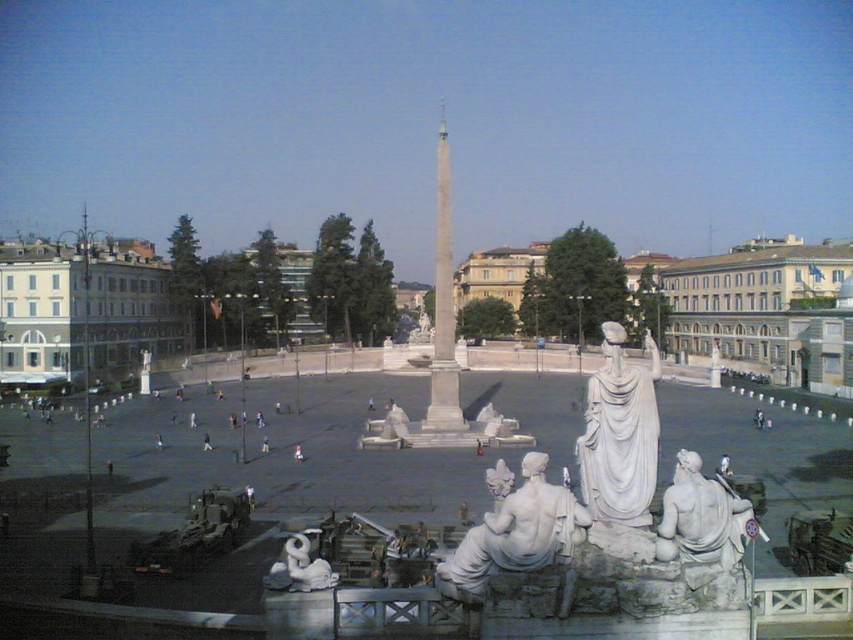
Question: Which is nearer to the white marble obelisk at center?

Choices:
 (A) white marble statue at lower center
 (B) white marble statue at lower right

Answer: (A)

Question: Can you confirm if white marble statues at center is bigger than white marble statue at lower center?

Choices:
 (A) no
 (B) yes

Answer: (B)

Question: Which of these objects is positioned farthest from the white marble statues at center?

Choices:
 (A) white marble obelisk at center
 (B) white marble statue at center
 (C) white marble statue at lower center

Answer: (C)

Question: Can you confirm if white marble statue at center is thinner than white marble obelisk at center?

Choices:
 (A) no
 (B) yes

Answer: (A)

Question: Among these points, which one is nearest to the camera?

Choices:
 (A) (735, 534)
 (B) (454, 419)
 (C) (573, 486)
 (D) (621, 324)

Answer: (A)

Question: Is white marble statue at center below white marble obelisk at center?

Choices:
 (A) no
 (B) yes

Answer: (B)